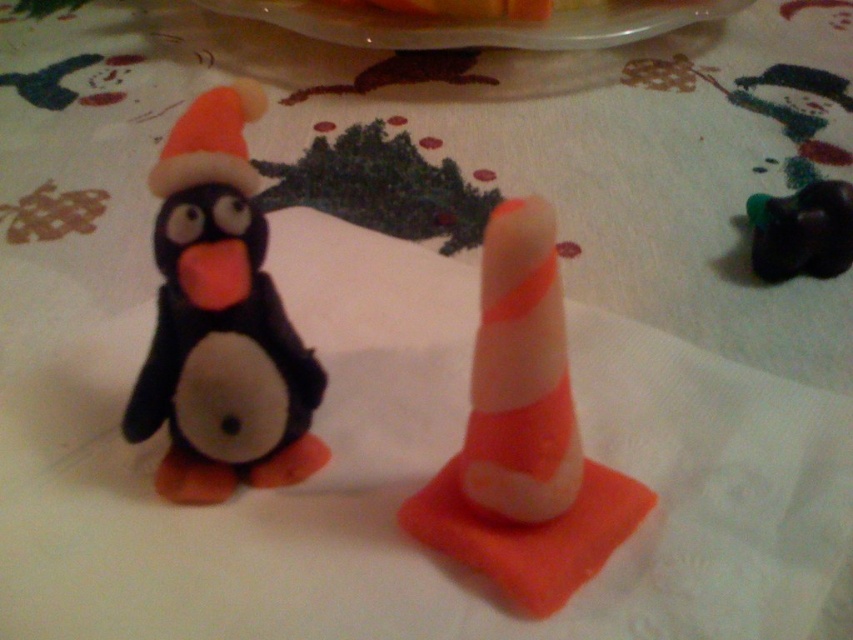
Question: Which object is positioned closest to the matte black penguin at left?

Choices:
 (A) orange striped foam cone at center
 (B) translucent plastic platter at upper center

Answer: (A)

Question: Based on their relative distances, which object is nearer to the translucent plastic platter at upper center?

Choices:
 (A) orange striped foam cone at center
 (B) matte black penguin at left

Answer: (A)

Question: Which of the following is the farthest from the observer?

Choices:
 (A) (492, 394)
 (B) (254, 420)

Answer: (B)

Question: Does orange striped foam cone at center lie behind translucent plastic platter at upper center?

Choices:
 (A) yes
 (B) no

Answer: (B)

Question: Does matte black penguin at left appear under translucent plastic platter at upper center?

Choices:
 (A) no
 (B) yes

Answer: (B)

Question: Does matte black penguin at left appear under translucent plastic platter at upper center?

Choices:
 (A) no
 (B) yes

Answer: (B)